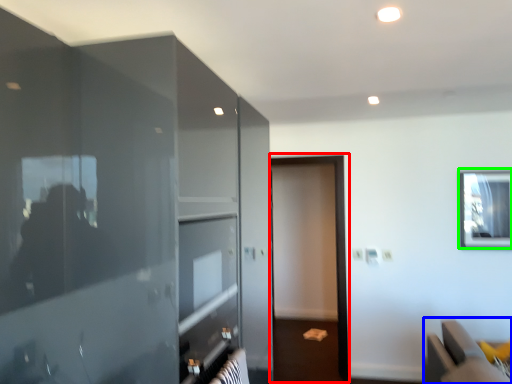
Question: Which object is positioned farthest from screen door (highlighted by a red box)? Select from furniture (highlighted by a blue box) and window (highlighted by a green box).

Choices:
 (A) furniture
 (B) window

Answer: (A)